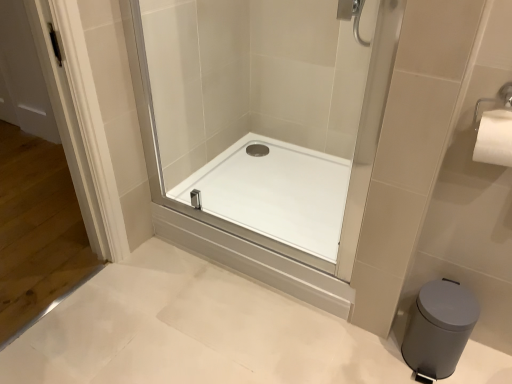
Find the location of a particular element. free region under transparent glass shower door at center (from a real-world perspective) is located at coordinates 224,226.